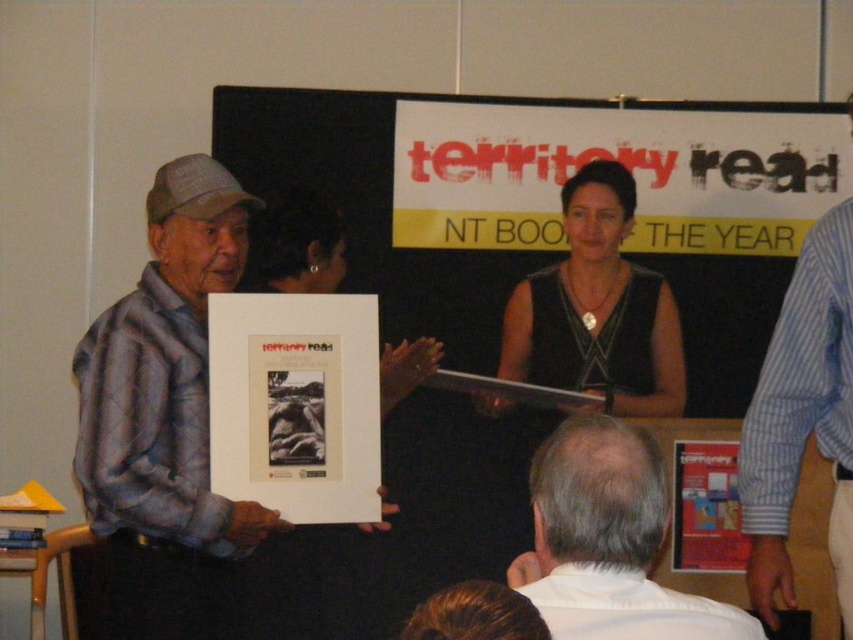
The image size is (853, 640). Describe the element at coordinates (624, 166) in the screenshot. I see `white paper at upper center` at that location.

Can you confirm if white paper at upper center is positioned below matte paper poster at center?

No, white paper at upper center is not below matte paper poster at center.

Locate an element on the screen. The height and width of the screenshot is (640, 853). white paper at upper center is located at coordinates (624, 166).

Which is more to the right, blue striped shirt at upper right or black fabric dress at center?

blue striped shirt at upper right

What do you see at coordinates (802, 417) in the screenshot?
I see `blue striped shirt at upper right` at bounding box center [802, 417].

Locate an element on the screen. This screenshot has height=640, width=853. blue striped shirt at upper right is located at coordinates (802, 417).

Which is above, white paper at center or white matte shirt at lower center?

white paper at center is above.

Does white paper at center have a lesser width compared to white matte shirt at lower center?

No, white paper at center is not thinner than white matte shirt at lower center.

Who is more forward, (706, 182) or (664, 637)?

Point (664, 637) is in front.

Where is `white paper at center`? The image size is (853, 640). white paper at center is located at coordinates tap(550, 204).